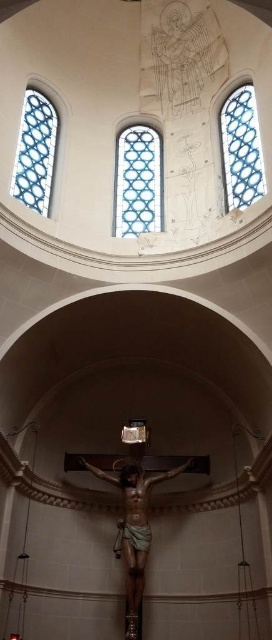
Question: In this image, where is blue stained glass at center located relative to blue stained glass at left?

Choices:
 (A) above
 (B) below

Answer: (B)

Question: Which object appears closest to the camera in this image?

Choices:
 (A) blue stained glass at upper right
 (B) blue stained glass at center

Answer: (A)

Question: Does blue stained glass at center have a smaller size compared to blue stained glass at left?

Choices:
 (A) yes
 (B) no

Answer: (B)

Question: Which of the following is the closest to the observer?

Choices:
 (A) blue stained glass at upper right
 (B) blue stained glass at left

Answer: (A)

Question: Which point is closer to the camera?

Choices:
 (A) blue stained glass at center
 (B) blue stained glass at left
 (C) blue stained glass at upper right

Answer: (C)

Question: Can you confirm if blue stained glass at center is wider than blue stained glass at upper right?

Choices:
 (A) yes
 (B) no

Answer: (A)